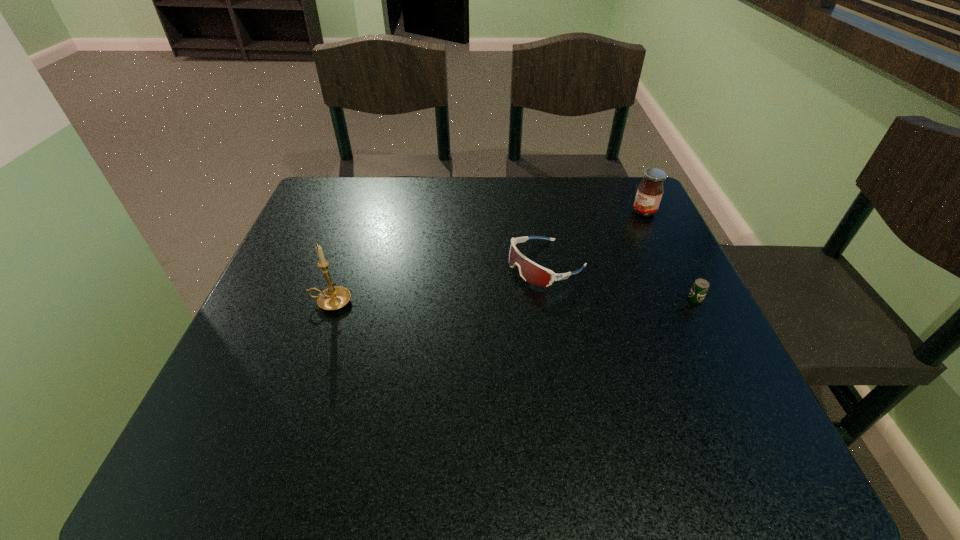
Find the location of a particular element. This screenshot has width=960, height=540. free space on the desktop that is between the leftmost object and the shortest object and is positioned on the front-facing side of the third object from right to left is located at coordinates (468, 301).

At what (x,y) coordinates should I click in order to perform the action: click on vacant spot on the desktop that is between the tallest object and the beer can and is positioned on the label side of the jam. Please return your answer as a coordinate pair (x, y). The image size is (960, 540). Looking at the image, I should click on (509, 301).